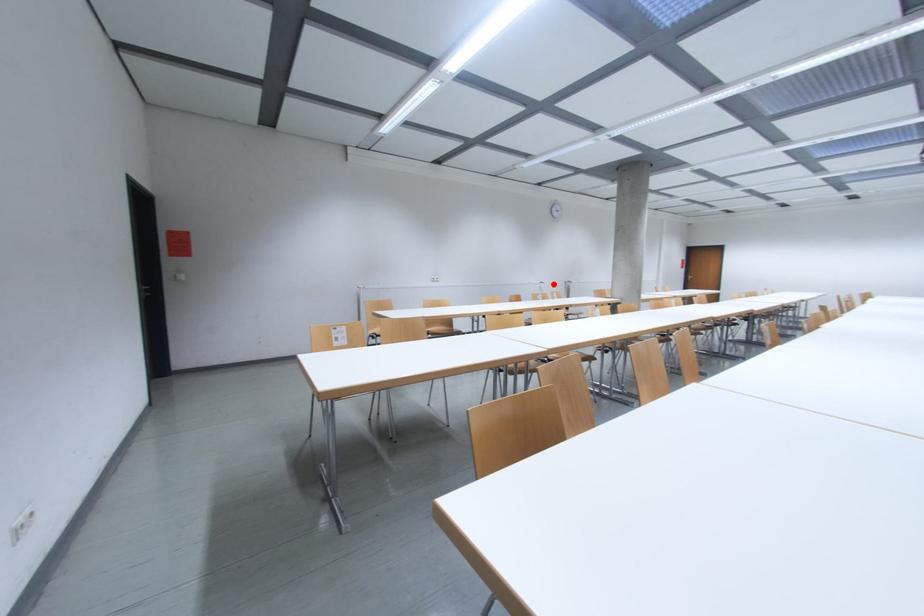
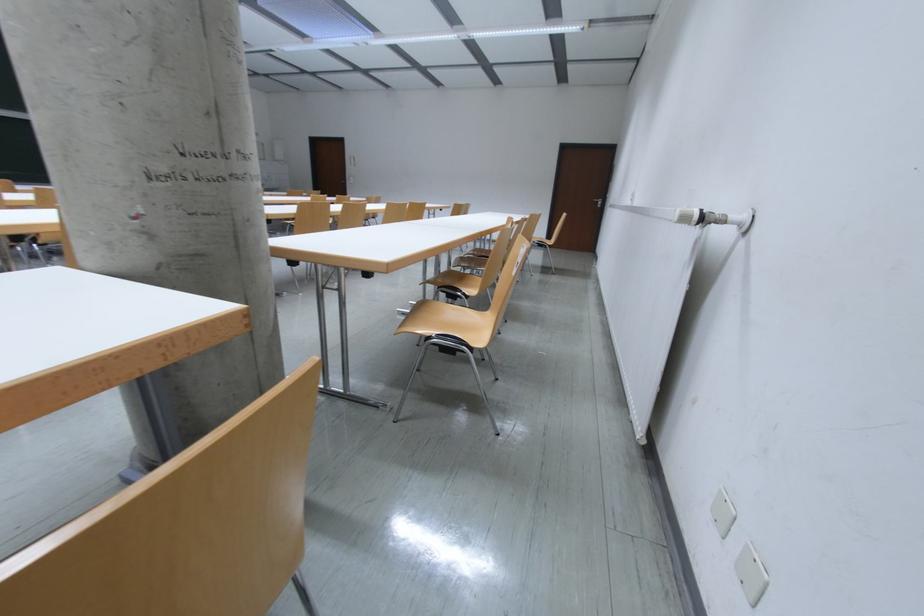
Where in the second image is the point corresponding to the highlighted location from the first image?

(694, 221)